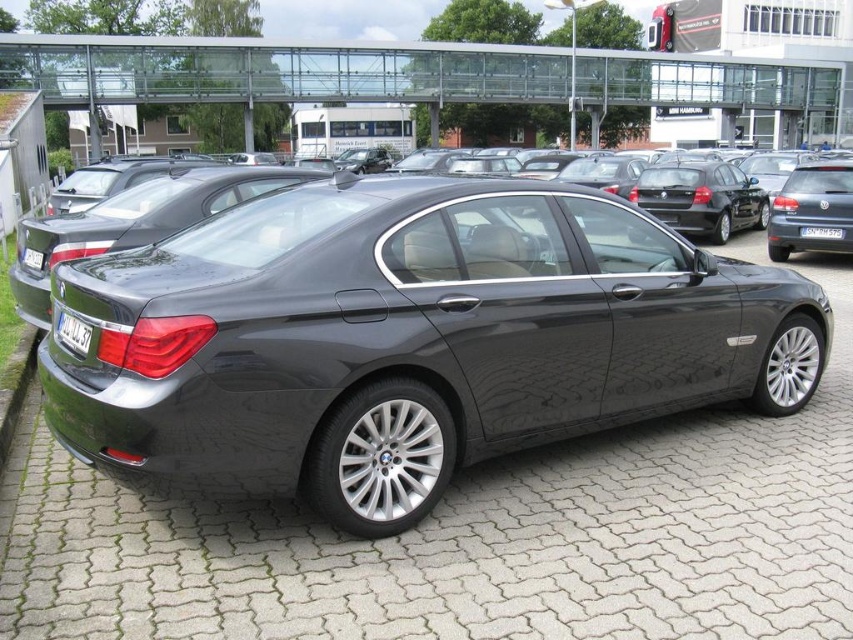
Question: Does matte black sedan at right have a lesser width compared to white plastic license plate at center?

Choices:
 (A) yes
 (B) no

Answer: (B)

Question: Is satin black sedan at center above black plastic license plate at rear?

Choices:
 (A) no
 (B) yes

Answer: (B)

Question: Which of these objects is positioned closest to the satin black sedan at center?

Choices:
 (A) black plastic license plate at rear
 (B) matte black sedan at right
 (C) white plastic license plate at rear
 (D) white plastic license plate at center

Answer: (A)

Question: Which object appears farthest from the camera in this image?

Choices:
 (A) white plastic license plate at rear
 (B) satin black sedan at center
 (C) matte black sedan at right

Answer: (C)

Question: Does satin black sedan at center appear on the right side of white plastic license plate at rear?

Choices:
 (A) no
 (B) yes

Answer: (B)

Question: Among these points, which one is nearest to the camera?

Choices:
 (A) (804, 227)
 (B) (96, 268)
 (C) (64, 323)

Answer: (C)